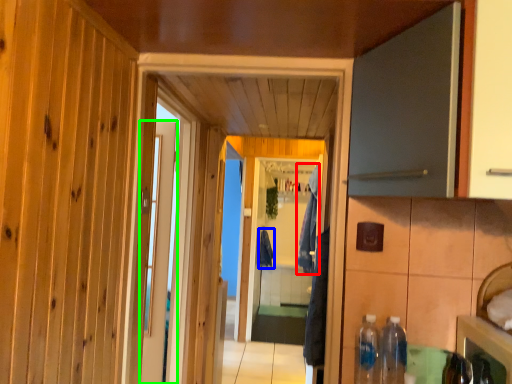
Question: Considering the real-world distances, which object is farthest from laundry (highlighted by a red box)? laundry (highlighted by a blue box) or door (highlighted by a green box)?

Choices:
 (A) laundry
 (B) door

Answer: (B)